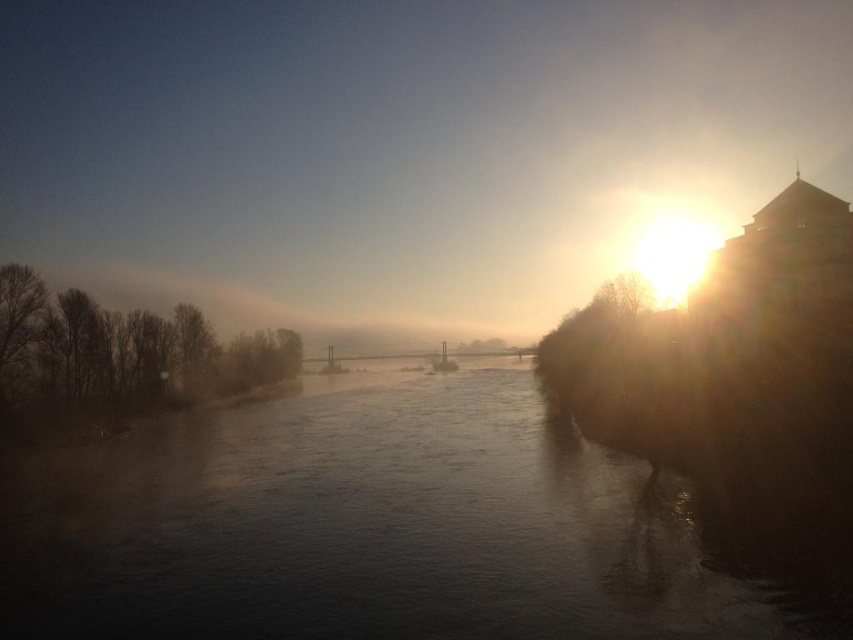
Between foggy mist at river center and dark water at center, which one has more height?

foggy mist at river center is taller.

Looking at this image, between foggy mist at river center and dark water at center, which one is positioned higher?

Positioned higher is foggy mist at river center.

Is point (769, 6) positioned after point (346, 449)?

Yes, point (769, 6) is behind point (346, 449).

Find the location of `foggy mist at river center`. foggy mist at river center is located at coordinates (399, 148).